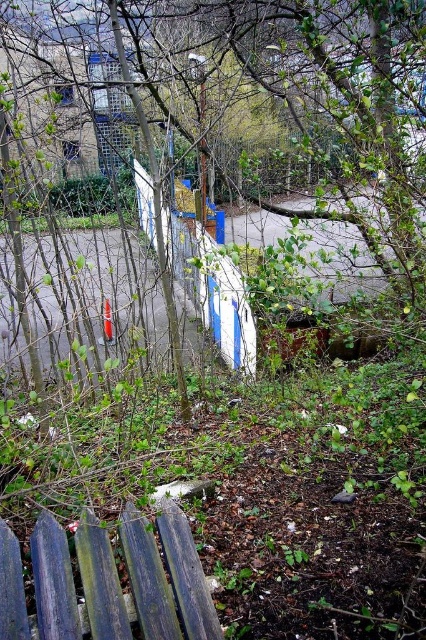
Question: Is green leafy tree at center thinner than blue weathered wood at lower left?

Choices:
 (A) no
 (B) yes

Answer: (A)

Question: Is green leafy tree at center above blue weathered wood at lower left?

Choices:
 (A) yes
 (B) no

Answer: (A)

Question: Is green leafy tree at center positioned behind blue weathered wood at lower left?

Choices:
 (A) yes
 (B) no

Answer: (A)

Question: Which object appears closest to the camera in this image?

Choices:
 (A) green leafy tree at center
 (B) blue weathered wood at lower left

Answer: (B)

Question: Which of the following is the farthest from the observer?

Choices:
 (A) (36, 524)
 (B) (241, 40)

Answer: (B)

Question: Which point is closer to the camera?

Choices:
 (A) green leafy tree at center
 (B) blue weathered wood at lower left

Answer: (B)